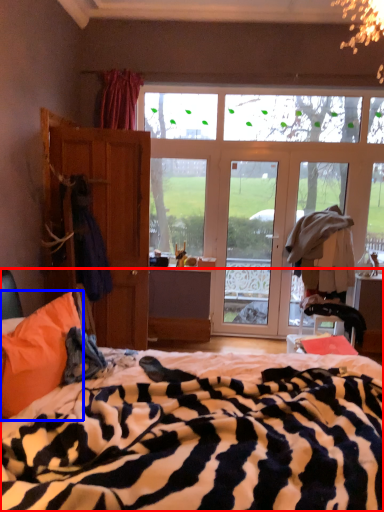
Question: Which object is closer to the camera taking this photo, bed (highlighted by a red box) or pillow (highlighted by a blue box)?

Choices:
 (A) bed
 (B) pillow

Answer: (A)